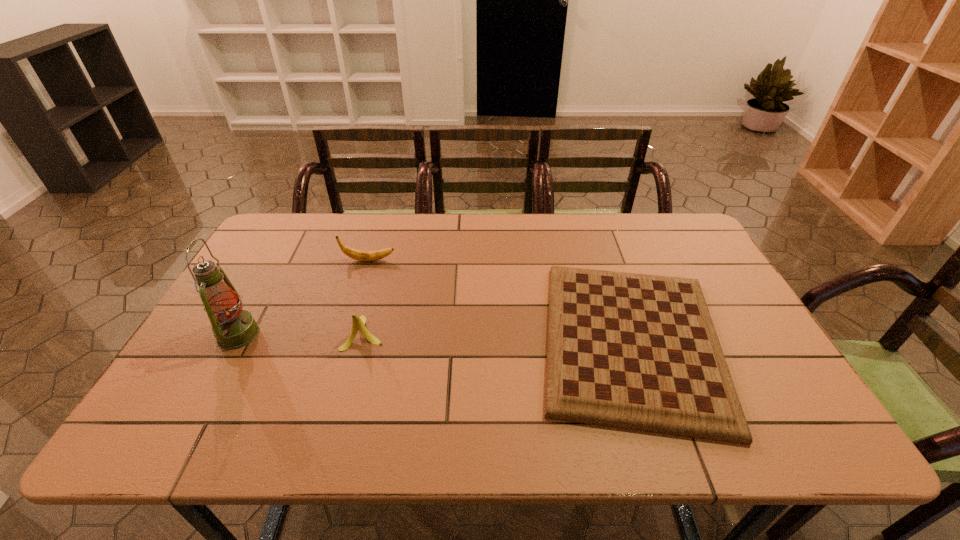
Identify the location of object present at the near edge. (635, 351).

I want to click on object at the left edge, so click(x=233, y=328).

Identify the location of object that is at the right edge. (635, 351).

Locate an element on the screen. The height and width of the screenshot is (540, 960). object present at the near right corner is located at coordinates (635, 351).

The height and width of the screenshot is (540, 960). I want to click on vacant space at the far edge of the desktop, so click(x=361, y=227).

In the image, there is a desktop. Identify the location of vacant space at the near edge. (265, 416).

What are the coordinates of `blank space at the left edge of the desktop` in the screenshot? It's located at (205, 379).

In the image, there is a desktop. Identify the location of vacant space at the right edge. (768, 389).

The width and height of the screenshot is (960, 540). Identify the location of vacant space that is in between the nearer banana and the rightmost object. (498, 337).

What are the coordinates of `vacant area between the farther banana and the leftmost object` in the screenshot? It's located at (303, 298).